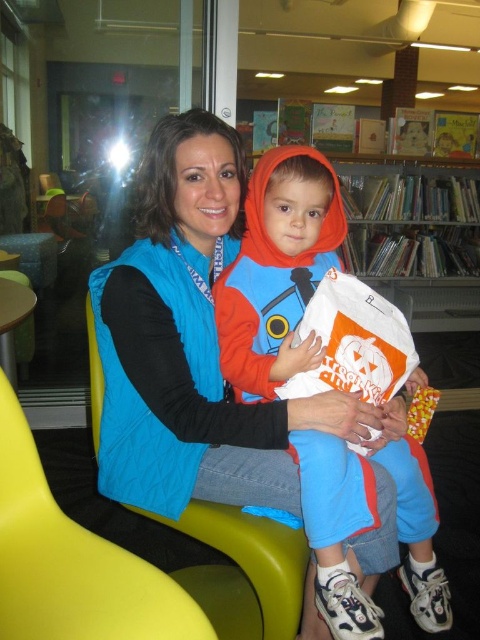
You are a visitor looking for the children section in this library. You see a matte orange hoodie at center and a wooden bookshelf at upper center. According to the scene, which object is positioned to the left side of the other?

The matte orange hoodie at center is to the left of wooden bookshelf at upper center.

You are designing a layout for a childrens reading area and need to place a new table between the yellow plastic chair at lower left and the wooden bookshelf at upper center. Which object should the table be placed closer to if it needs to be near the thinner object?

The table should be placed closer to the yellow plastic chair at lower left since it is thinner than the wooden bookshelf at upper center.

You are standing at the entrance of the library and want to reach the woman holding the child. The entrance is near point A at coordinates point (189,524). The woman is sitting at point B at coordinates point (422,620). Which direction should you move to reach her?

To reach the woman holding the child at point B at coordinates point (422,620), you should move towards the direction of point B. Since point B is behind point A, you need to move backward from the entrance to reach her location.